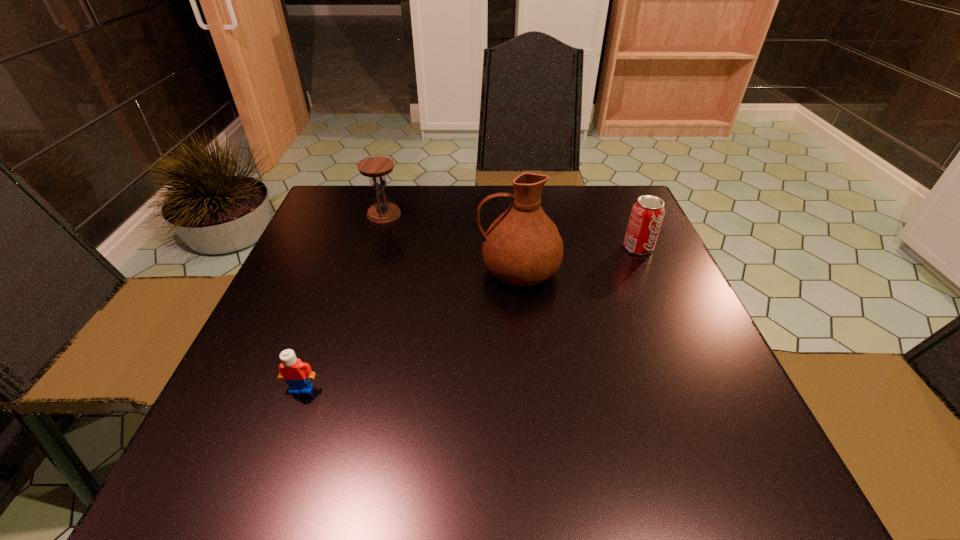
In the image, there is a desktop. Where is `free region at the right edge`? This screenshot has width=960, height=540. free region at the right edge is located at coordinates (682, 394).

You are a GUI agent. You are given a task and a screenshot of the screen. Output one action in this format:
    pyautogui.click(x=<x>, y=<y>)
    Task: Click on the free space at the near left corner of the desktop
    This screenshot has width=960, height=540.
    Given the screenshot: What is the action you would take?
    pyautogui.click(x=243, y=475)

This screenshot has width=960, height=540. In order to click on free space at the far right corner of the desktop in this screenshot , I will do (574, 185).

I want to click on free space at the near right corner of the desktop, so click(x=665, y=470).

At what (x,y) coordinates should I click in order to perform the action: click on free space between the Lego and the rightmost object. Please return your answer as a coordinate pair (x, y). Looking at the image, I should click on (469, 318).

Locate an element on the screen. This screenshot has width=960, height=540. free area in between the soda can and the nearest object is located at coordinates (469, 318).

Image resolution: width=960 pixels, height=540 pixels. What are the coordinates of `vacant space in between the hourglass and the third object from left to right` in the screenshot? It's located at (451, 243).

Where is `vacant space in between the tallest object and the hourglass`? vacant space in between the tallest object and the hourglass is located at coordinates (451, 243).

Image resolution: width=960 pixels, height=540 pixels. Find the location of `free spot between the farthest object and the pitcher`. free spot between the farthest object and the pitcher is located at coordinates (451, 243).

Locate an element on the screen. free space that is in between the rightmost object and the nearest object is located at coordinates (469, 318).